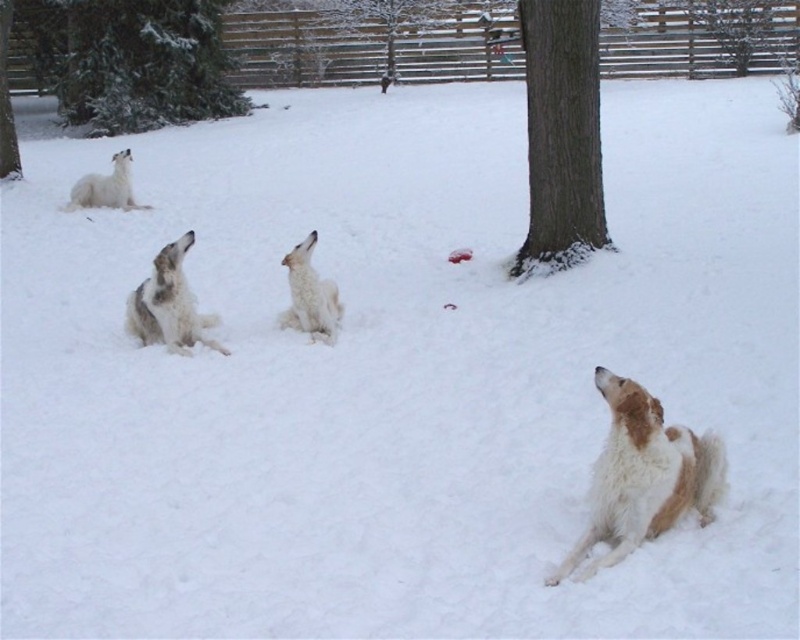
Is brown wood tree at upper center bigger than green textured tree at upper left?

Yes, brown wood tree at upper center is bigger than green textured tree at upper left.

Who is positioned more to the left, brown wood tree at upper center or green textured tree at upper left?

green textured tree at upper left

Find the location of a particular element. This screenshot has height=640, width=800. brown wood tree at upper center is located at coordinates (734, 26).

This screenshot has width=800, height=640. Identify the location of brown wood tree at upper center. (734, 26).

Does white fluffy dog at center have a smaller size compared to green textured tree at upper left?

Indeed, white fluffy dog at center has a smaller size compared to green textured tree at upper left.

Based on the photo, between white fluffy dog at center and green textured tree at upper left, which one appears on the left side from the viewer's perspective?

green textured tree at upper left is more to the left.

Does point (310, 246) come in front of point (0, 64)?

Yes, it is.

Identify the location of white fluffy dog at center. (310, 296).

Who is lower down, green textured evergreen tree at upper left or brown rough bark tree at center?

Positioned lower is brown rough bark tree at center.

Measure the distance between point (72, 60) and camera.

Point (72, 60) is 19.20 meters from camera.

This screenshot has height=640, width=800. Identify the location of green textured evergreen tree at upper left. (134, 61).